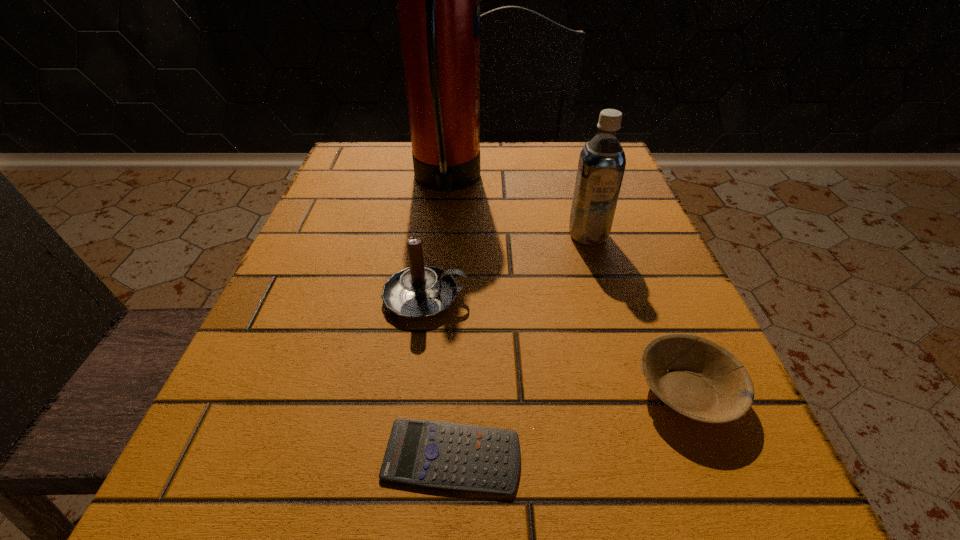
You are a GUI agent. You are given a task and a screenshot of the screen. Output one action in this format:
    pyautogui.click(x=<x>, y=<y>)
    Task: Click on the vacant space at the right edge
    The width and height of the screenshot is (960, 540).
    Given the screenshot: What is the action you would take?
    pyautogui.click(x=641, y=394)

Locate an element on the screen. vacant space at the far left corner of the desktop is located at coordinates (390, 171).

What are the coordinates of `vacant point located between the calculator and the fourth nearest object` in the screenshot? It's located at (519, 346).

At what (x,y) coordinates should I click in order to perform the action: click on empty location between the shortest object and the farthest object. Please return your answer as a coordinate pair (x, y). Looking at the image, I should click on (449, 319).

Where is `empty space that is in between the candle and the tallest object`? This screenshot has height=540, width=960. empty space that is in between the candle and the tallest object is located at coordinates coord(436,240).

Locate an element on the screen. The width and height of the screenshot is (960, 540). vacant area that lies between the soya milk and the bowl is located at coordinates (637, 313).

I want to click on free space between the tallest object and the bowl, so click(x=566, y=287).

Find the location of `free space between the third shortest object and the second farthest object`. free space between the third shortest object and the second farthest object is located at coordinates (507, 266).

At what (x,y) coordinates should I click in order to perform the action: click on unoccupied position between the bowl and the fourth nearest object. Please return your answer as a coordinate pair (x, y). This screenshot has width=960, height=540. Looking at the image, I should click on (637, 313).

At what (x,y) coordinates should I click in order to perform the action: click on free area in between the third nearest object and the shortest object. Please return your answer as a coordinate pair (x, y). The height and width of the screenshot is (540, 960). Looking at the image, I should click on (439, 377).